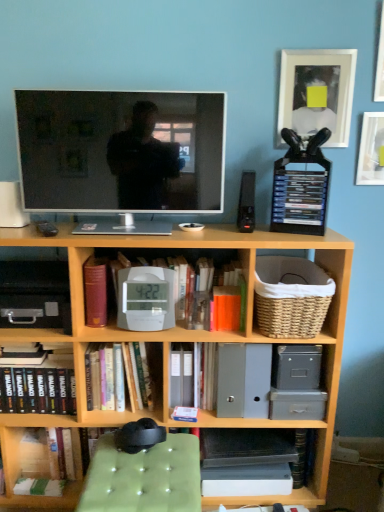
The height and width of the screenshot is (512, 384). Find the location of `free point above white plastic clock at center, marked as the 1th book in a right-to-left arrangement (from a real-world perspective)`. free point above white plastic clock at center, marked as the 1th book in a right-to-left arrangement (from a real-world perspective) is located at coordinates (182, 252).